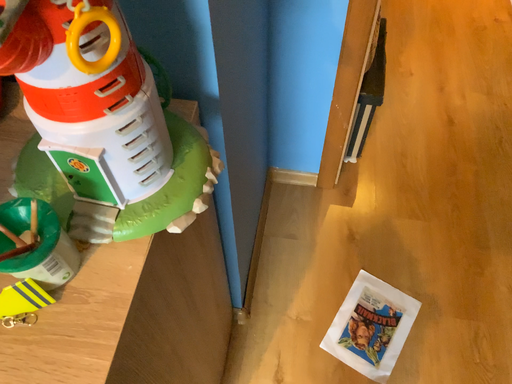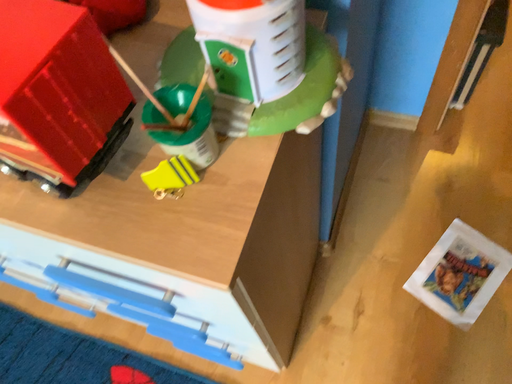
Question: Which way did the camera rotate in the video?

Choices:
 (A) rotated left
 (B) rotated right

Answer: (A)